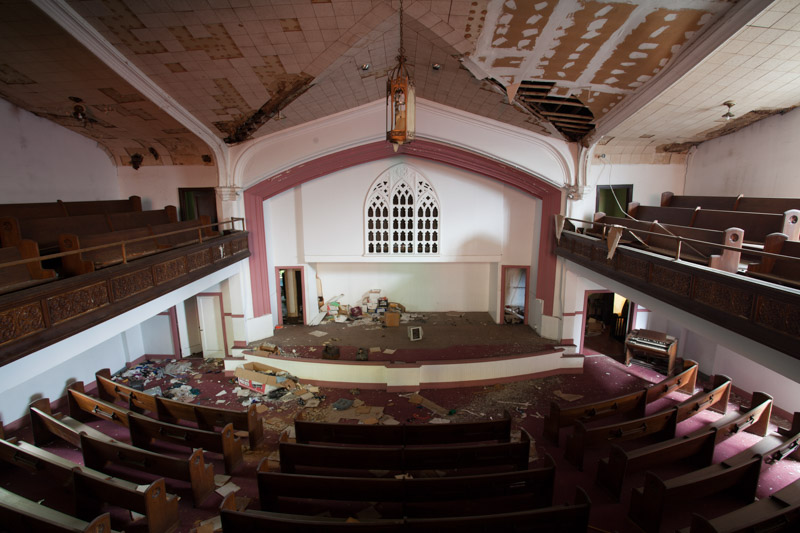
The image size is (800, 533). What are the coordinates of `monitor` in the screenshot? It's located at (414, 335).